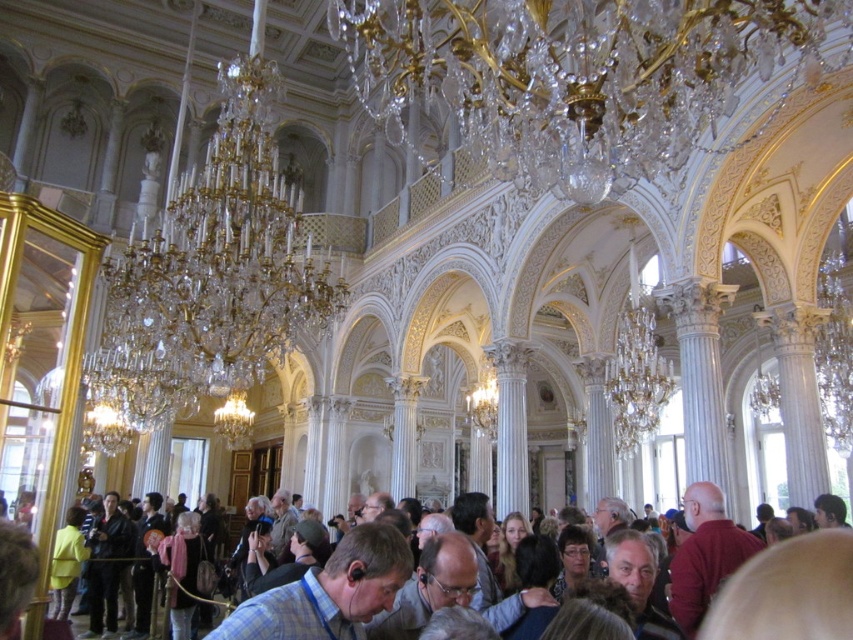
Is crystal/glass chandelier at upper center taller than blue plaid shirt at center?

Yes.

Which is above, crystal/glass chandelier at upper center or blue plaid shirt at center?

crystal/glass chandelier at upper center is above.

Does point (846, 20) come behind point (346, 552)?

No.

The height and width of the screenshot is (640, 853). I want to click on crystal/glass chandelier at upper center, so click(x=579, y=76).

This screenshot has width=853, height=640. What do you see at coordinates (788, 592) in the screenshot?
I see `dark brown leather jacket at center` at bounding box center [788, 592].

Between point (752, 592) and point (343, 608), which one is positioned behind?

The point (343, 608) is more distant.

Where is `dark brown leather jacket at center`? The height and width of the screenshot is (640, 853). dark brown leather jacket at center is located at coordinates (788, 592).

What do you see at coordinates (213, 272) in the screenshot?
I see `crystal/golden chandelier at upper center` at bounding box center [213, 272].

Who is shorter, crystal/golden chandelier at upper center or dark brown leather jacket at center?

Standing shorter between the two is dark brown leather jacket at center.

Is point (157, 320) farther from camera compared to point (782, 614)?

Yes.

I want to click on crystal/golden chandelier at upper center, so click(x=213, y=272).